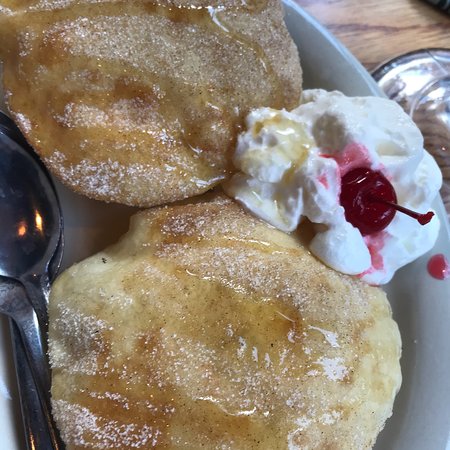
The height and width of the screenshot is (450, 450). I want to click on glass surface, so click(x=429, y=105).